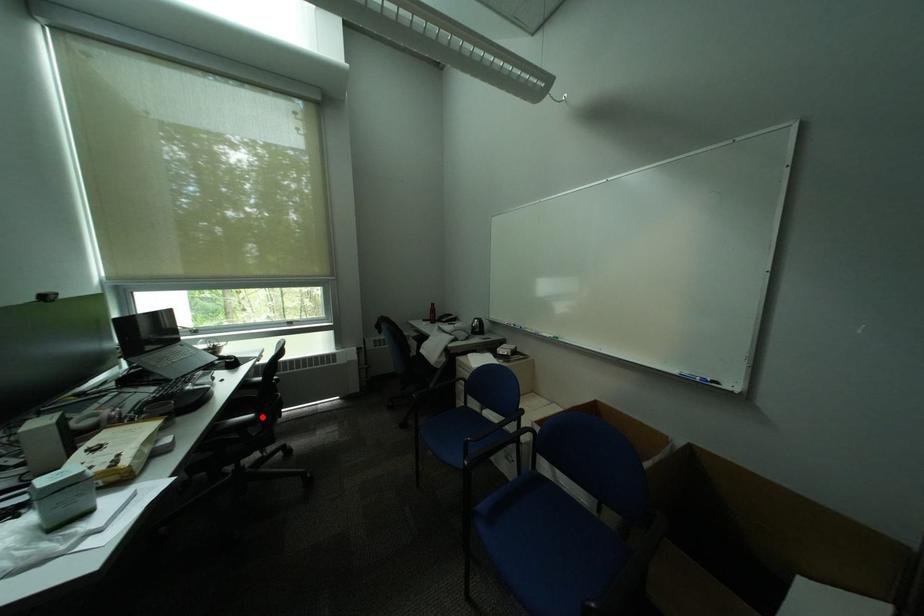
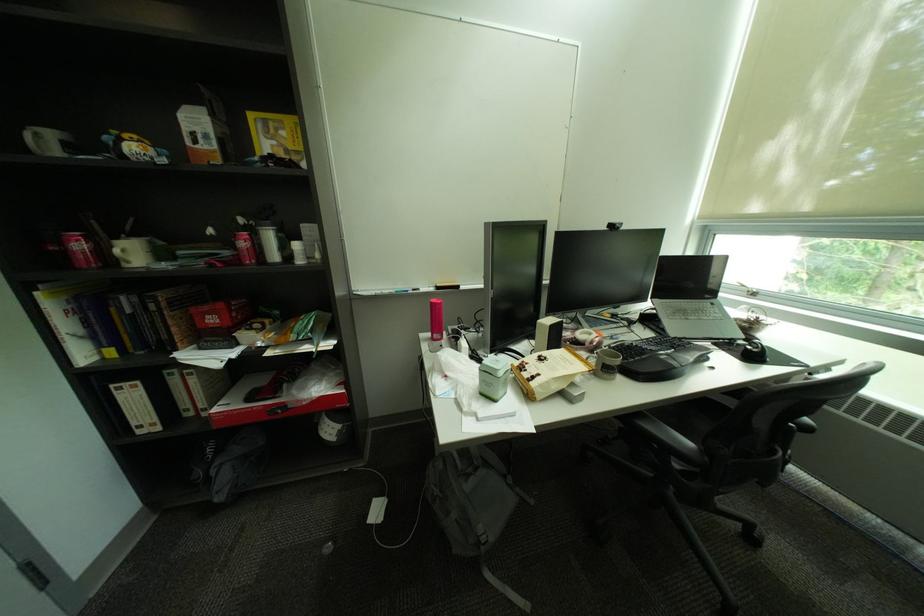
Question: I am providing you with two images of the same scene from different viewpoints. In image1, a red point is highlighted. Considering the same 3D point in image2, which of the following is correct?

Choices:
 (A) It is closer
 (B) It is farther

Answer: (B)